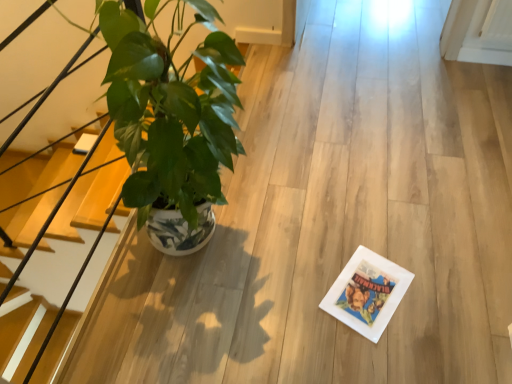
Identify the location of unoccupied region to the right of green glossy plant at left. (312, 230).